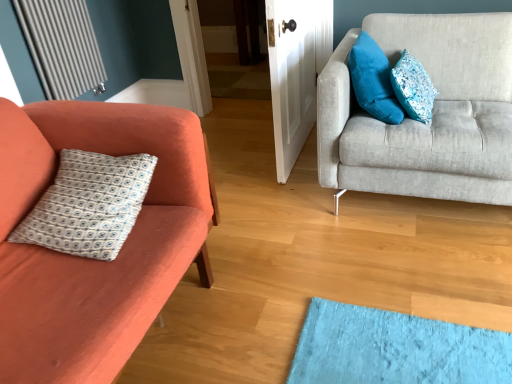
Question: From a real-world perspective, is matte orange couch at left, arranged as the 1th studio couch when viewed from the left, below velvety blue pillow at upper right, which ranks as the second pillow in right-to-left order?

Choices:
 (A) no
 (B) yes

Answer: (B)

Question: Can you confirm if matte orange couch at left, marked as the 2th studio couch in a right-to-left arrangement, is positioned to the right of velvety blue pillow at upper right, which ranks as the second pillow in right-to-left order?

Choices:
 (A) yes
 (B) no

Answer: (B)

Question: Is matte orange couch at left, marked as the 2th studio couch in a right-to-left arrangement, not inside velvety blue pillow at upper right, which ranks as the second pillow in right-to-left order?

Choices:
 (A) no
 (B) yes

Answer: (B)

Question: Does matte orange couch at left, marked as the 2th studio couch in a right-to-left arrangement, have a smaller size compared to velvety blue pillow at upper right, which is counted as the 2th pillow, starting from the left?

Choices:
 (A) no
 (B) yes

Answer: (A)

Question: Is matte orange couch at left, arranged as the 1th studio couch when viewed from the left, turned away from velvety blue pillow at upper right, which is counted as the 2th pillow, starting from the left?

Choices:
 (A) yes
 (B) no

Answer: (B)

Question: From the image's perspective, relative to white printed fabric pillow at left, acting as the third pillow starting from the right, is matte orange couch at left, marked as the 2th studio couch in a right-to-left arrangement, above or below?

Choices:
 (A) above
 (B) below

Answer: (B)

Question: Considering the positions of point (0, 114) and point (71, 153), is point (0, 114) closer or farther from the camera than point (71, 153)?

Choices:
 (A) closer
 (B) farther

Answer: (A)

Question: From a real-world perspective, is matte orange couch at left, marked as the 2th studio couch in a right-to-left arrangement, positioned above or below white printed fabric pillow at left, acting as the third pillow starting from the right?

Choices:
 (A) below
 (B) above

Answer: (A)

Question: In the image, is matte orange couch at left, arranged as the 1th studio couch when viewed from the left, positioned in front of or behind white printed fabric pillow at left, acting as the third pillow starting from the right?

Choices:
 (A) front
 (B) behind

Answer: (A)

Question: Visually, is white printed fabric pillow at left, the first pillow in the left-to-right sequence, positioned to the left or to the right of light gray fabric couch at right, acting as the first studio couch starting from the right?

Choices:
 (A) right
 (B) left

Answer: (B)

Question: From a real-world perspective, is white printed fabric pillow at left, acting as the third pillow starting from the right, above or below light gray fabric couch at right, acting as the first studio couch starting from the right?

Choices:
 (A) above
 (B) below

Answer: (A)

Question: Do you think white printed fabric pillow at left, acting as the third pillow starting from the right, is within light gray fabric couch at right, acting as the first studio couch starting from the right, or outside of it?

Choices:
 (A) outside
 (B) inside

Answer: (A)

Question: Considering the positions of point (155, 160) and point (329, 144), is point (155, 160) closer or farther from the camera than point (329, 144)?

Choices:
 (A) farther
 (B) closer

Answer: (B)

Question: From a real-world perspective, is metallic silver radiator at upper left physically located above or below white printed fabric pillow at left, the first pillow in the left-to-right sequence?

Choices:
 (A) above
 (B) below

Answer: (A)

Question: Considering the positions of point (15, 8) and point (154, 157), is point (15, 8) closer or farther from the camera than point (154, 157)?

Choices:
 (A) farther
 (B) closer

Answer: (A)